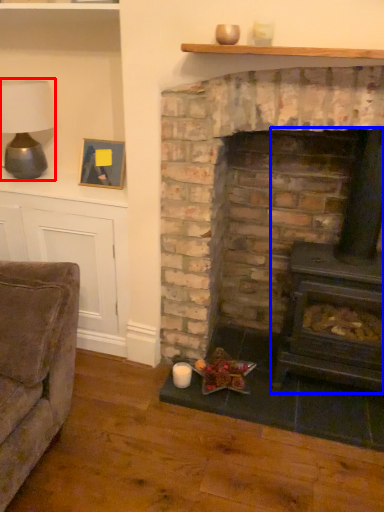
Question: Which of the following is the closest to the observer, table lamp (highlighted by a red box) or wood burning stove (highlighted by a blue box)?

Choices:
 (A) table lamp
 (B) wood burning stove

Answer: (B)